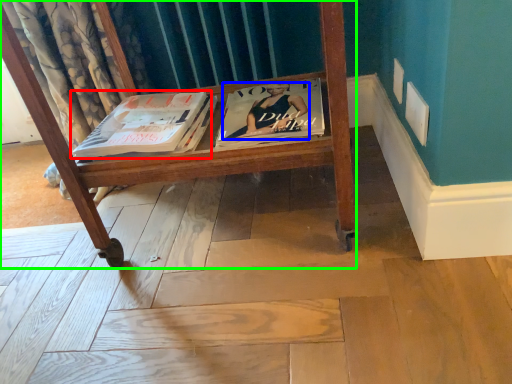
Question: Based on their relative distances, which object is nearer to book (highlighted by a red box)? Choose from person (highlighted by a blue box) and furniture (highlighted by a green box).

Choices:
 (A) person
 (B) furniture

Answer: (B)